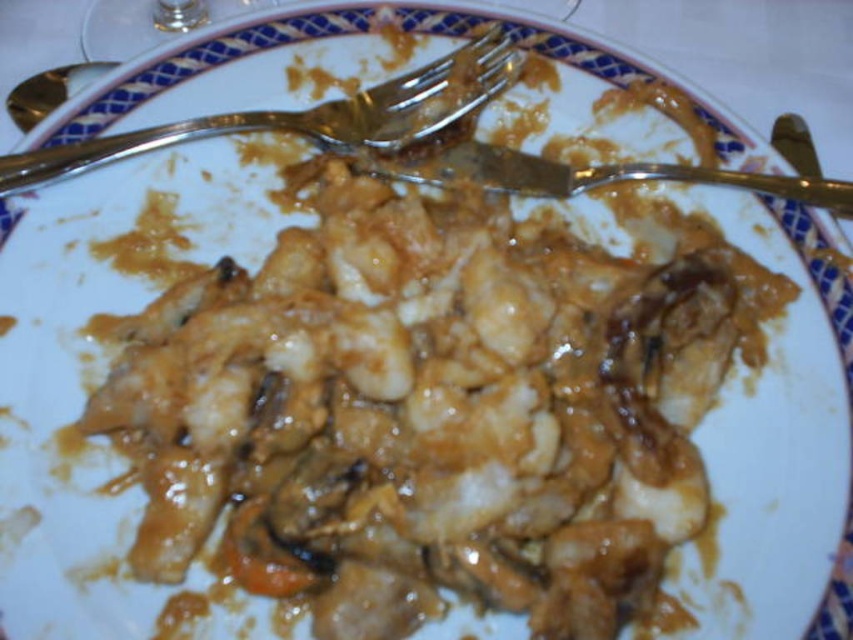
Question: Which object is closer to the camera taking this photo?

Choices:
 (A) gold metallic fork at upper left
 (B) gold metallic spoon at upper left

Answer: (A)

Question: Which point is closer to the camera taking this photo?

Choices:
 (A) (401, 86)
 (B) (65, 67)

Answer: (A)

Question: Can you confirm if gold metallic fork at upper left is smaller than gold metallic spoon at upper left?

Choices:
 (A) no
 (B) yes

Answer: (A)

Question: Among these objects, which one is farthest from the camera?

Choices:
 (A) satin silver knife at center
 (B) gold metallic fork at upper left

Answer: (A)

Question: Is satin silver knife at center positioned at the back of gold metallic spoon at upper left?

Choices:
 (A) no
 (B) yes

Answer: (A)

Question: Does satin silver knife at center have a smaller size compared to gold metallic spoon at upper left?

Choices:
 (A) yes
 (B) no

Answer: (B)